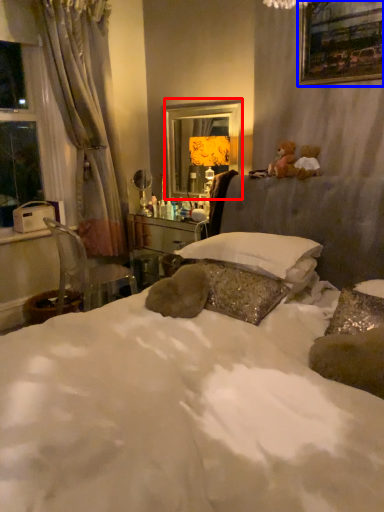
Question: Which object appears closest to the camera in this image, mirror (highlighted by a red box) or picture frame (highlighted by a blue box)?

Choices:
 (A) mirror
 (B) picture frame

Answer: (B)